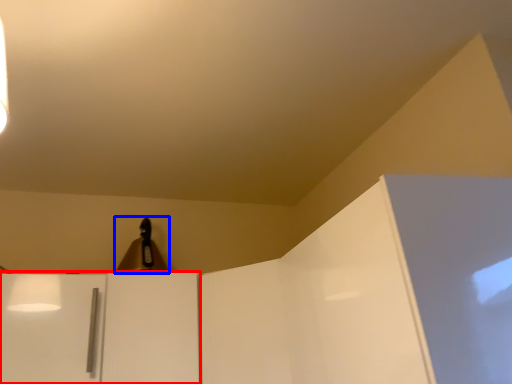
Question: Which object is closer to the camera taking this photo, cabinetry (highlighted by a red box) or lamp (highlighted by a blue box)?

Choices:
 (A) cabinetry
 (B) lamp

Answer: (A)